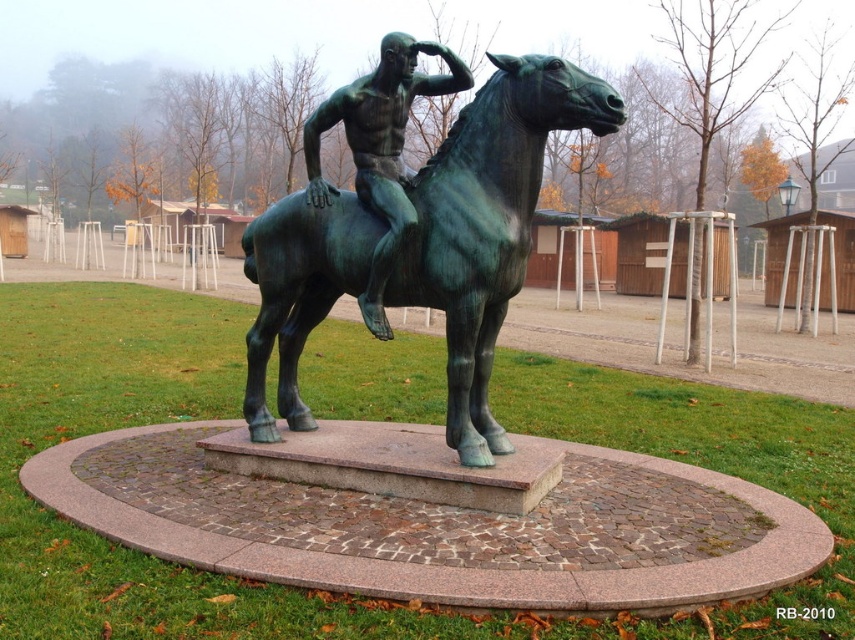
Between green patina horse at center and green patina statue at center, which one appears on the left side from the viewer's perspective?

green patina statue at center is more to the left.

Can you confirm if green patina horse at center is shorter than green patina statue at center?

No.

Which is in front, point (568, 83) or point (317, 134)?

Point (568, 83)

Find the location of `green patina horse at center`. green patina horse at center is located at coordinates coord(488,221).